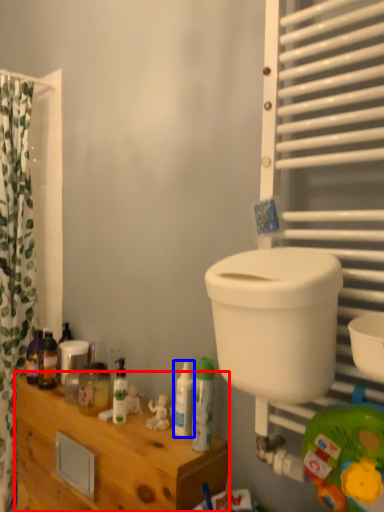
Question: Among these objects, which one is nearest to the camera, furniture (highlighted by a red box) or toiletry (highlighted by a blue box)?

Choices:
 (A) furniture
 (B) toiletry

Answer: (A)